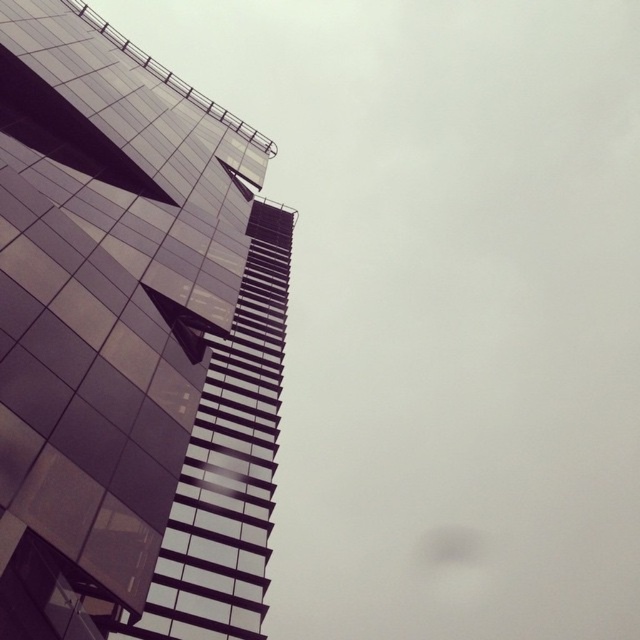
Question: From the image, what is the correct spatial relationship of reflective glass building at left in relation to reflective glass tower at upper left?

Choices:
 (A) below
 (B) above

Answer: (B)

Question: Among these objects, which one is farthest from the camera?

Choices:
 (A) reflective glass building at left
 (B) reflective glass tower at upper left

Answer: (B)

Question: Which point is closer to the camera taking this photo?

Choices:
 (A) (195, 449)
 (B) (113, 637)

Answer: (B)

Question: Does reflective glass building at left come in front of reflective glass tower at upper left?

Choices:
 (A) yes
 (B) no

Answer: (A)

Question: Does reflective glass building at left have a lesser width compared to reflective glass tower at upper left?

Choices:
 (A) yes
 (B) no

Answer: (B)